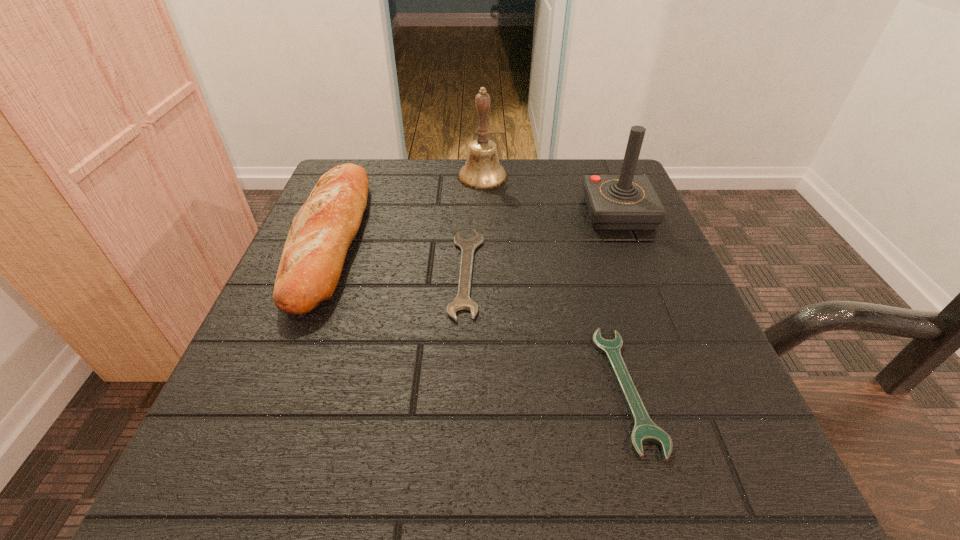
In order to click on free space located on the right of the left wrench in this screenshot , I will do `click(671, 273)`.

You are a GUI agent. You are given a task and a screenshot of the screen. Output one action in this format:
    pyautogui.click(x=<x>, y=<y>)
    Task: Click on the vacant space located on the left of the right wrench
    This screenshot has height=540, width=960.
    Given the screenshot: What is the action you would take?
    pyautogui.click(x=426, y=389)

Locate an element on the screen. The height and width of the screenshot is (540, 960). bell located at the far edge is located at coordinates (482, 171).

This screenshot has width=960, height=540. What are the coordinates of `joystick positioned at the far edge` in the screenshot? It's located at (626, 202).

This screenshot has width=960, height=540. What are the coordinates of `baguet that is at the far edge` in the screenshot? It's located at 322,231.

This screenshot has height=540, width=960. I want to click on object that is at the near edge, so click(645, 430).

Find the location of a particular element. Image resolution: width=960 pixels, height=540 pixels. object present at the left edge is located at coordinates (322, 231).

Locate an element on the screen. joystick that is at the right edge is located at coordinates (626, 202).

Identify the location of wrench at the right edge. This screenshot has width=960, height=540. (645, 430).

Find the location of a particular element. object present at the far left corner is located at coordinates (322, 231).